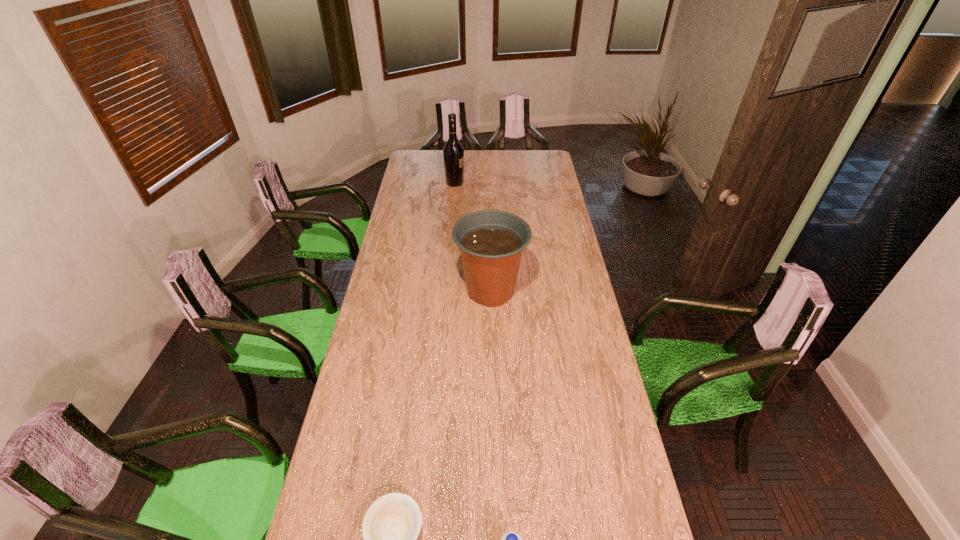
At what (x,y) coordinates should I click in order to perform the action: click on blank space that satisfies the following two spatial constraints: 1. on the label of the tallest object; 2. on the back side of the flowerpot. Please return your answer as a coordinate pair (x, y). This screenshot has height=540, width=960. Looking at the image, I should click on (445, 291).

Find the location of a particular element. vacant space that satisfies the following two spatial constraints: 1. on the label of the tallest object; 2. on the right side of the third shortest object is located at coordinates (445, 291).